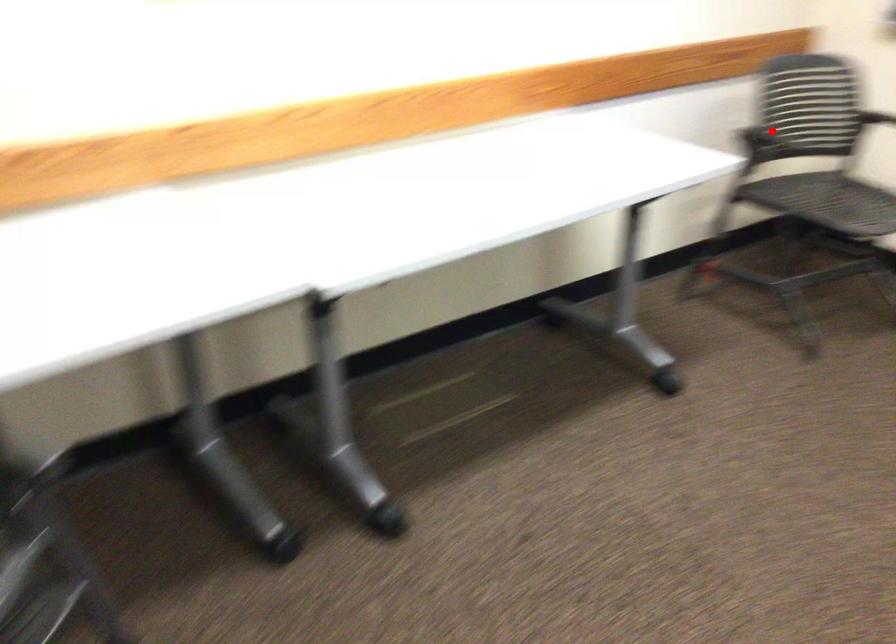
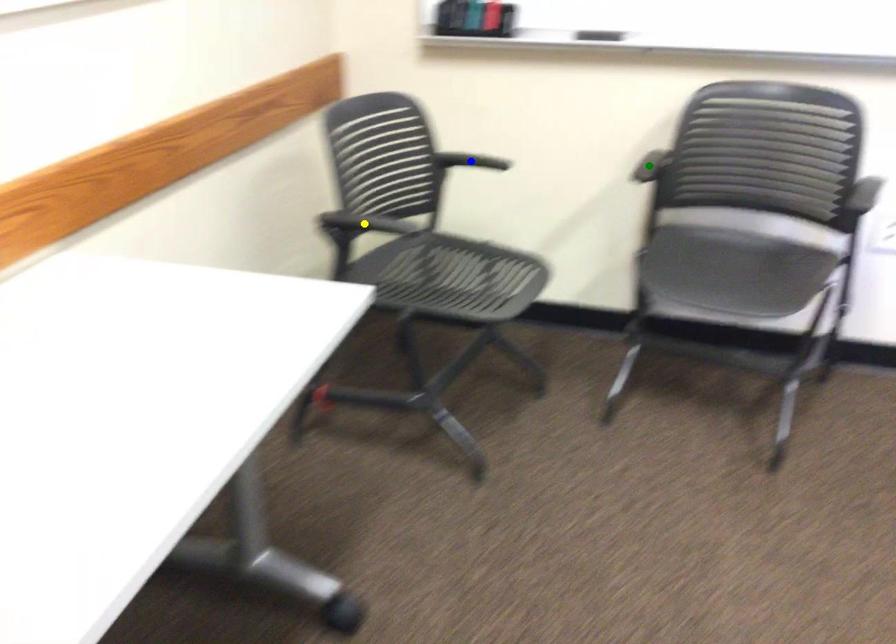
Question: I am providing you with two images of the same scene from different viewpoints. A red point is marked on the first image. You are given multiple points on the second image. In image 2, which mark is for the same physical point as the one in image 1?

Choices:
 (A) yellow point
 (B) green point
 (C) blue point

Answer: (A)